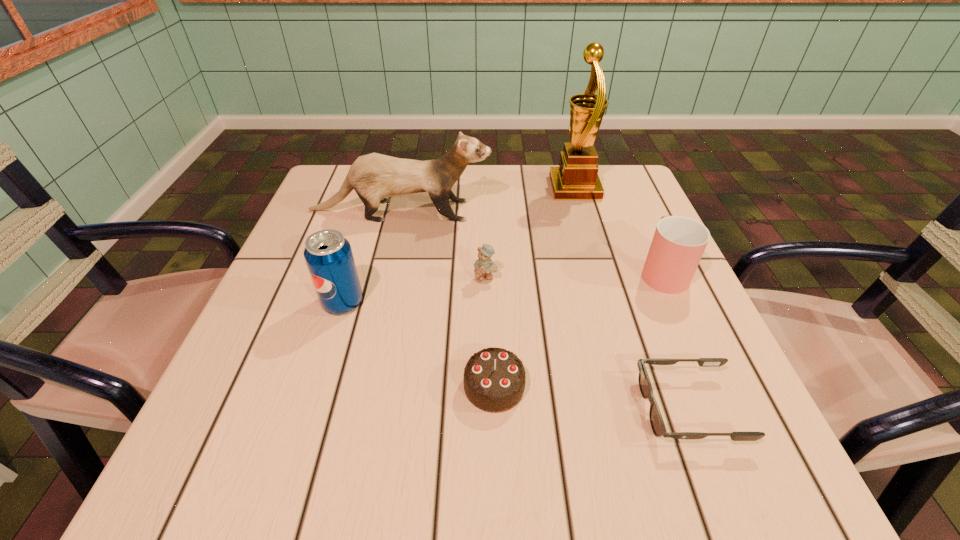
Identify the location of the tallest object. (576, 178).

At what (x,y) coordinates should I click in order to perform the action: click on ferret. Please return your answer as a coordinate pair (x, y). The image size is (960, 540). Looking at the image, I should click on (374, 177).

At what (x,y) coordinates should I click in order to perform the action: click on pop soda. Please return your answer as a coordinate pair (x, y). This screenshot has height=540, width=960. Looking at the image, I should click on (328, 254).

Where is `cup`? cup is located at coordinates (678, 244).

At what (x,y) coordinates should I click in order to perform the action: click on teddy bear. Please return your answer as a coordinate pair (x, y). The image size is (960, 540). Looking at the image, I should click on (484, 266).

Locate an element on the screen. The height and width of the screenshot is (540, 960). chocolate cake is located at coordinates (494, 379).

At what (x,y) coordinates should I click in order to perform the action: click on sunglasses. Please return your answer as a coordinate pair (x, y). Looking at the image, I should click on (658, 427).

The height and width of the screenshot is (540, 960). In order to click on vacant space located on the front-facing side of the tallest object in this screenshot , I will do `click(532, 188)`.

Find the location of a particular element. This screenshot has height=540, width=960. free space located 0.300m on the front-facing side of the tallest object is located at coordinates (x=436, y=188).

Locate an element on the screen. Image resolution: width=960 pixels, height=540 pixels. blank space located 0.160m on the front-facing side of the tallest object is located at coordinates (490, 188).